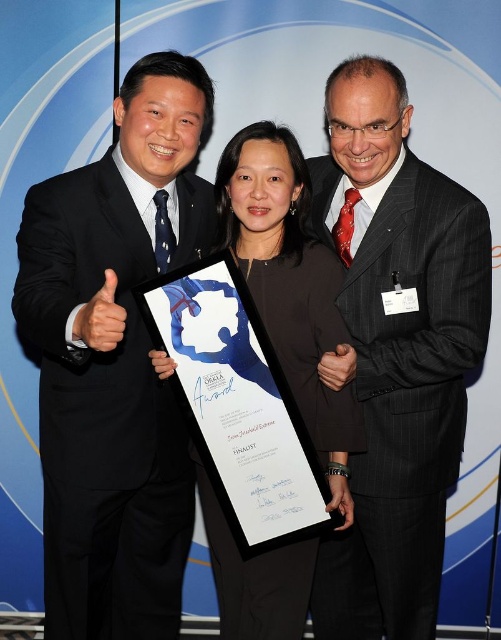
You are a photographer standing at a distance. You see the black pinstripe suit at center. Can you reach out and touch it without moving?

The black pinstripe suit at center is 1.67 meters from the viewer, so you cannot reach out and touch it without moving closer.

You are attending a corporate event and see two people dressed in black suits. One is wearing a matte black suit at left and the other a black pinstripe suit at center. Based on their positions, which one is standing closer to the left side of the stage?

The matte black suit at left is standing closer to the left side of the stage because it is positioned to the left of the black pinstripe suit at center.

You are a photographer at an awards ceremony and need to adjust the lighting to ensure both the matte black suit at left and the black fabric dress at center are visible. Which object is positioned to the left of the other?

The matte black suit at left is positioned on the left side of black fabric dress at center.